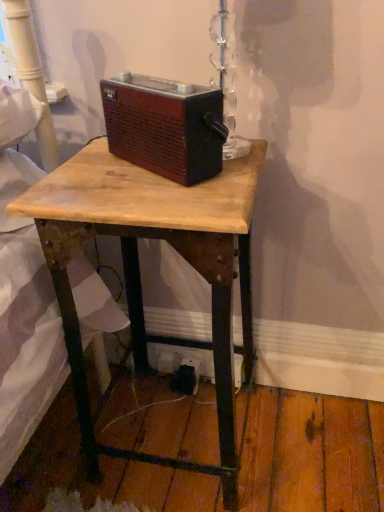
Question: Visually, is black plastic outlet at lower center positioned to the left or to the right of brown wood radio at center?

Choices:
 (A) left
 (B) right

Answer: (B)

Question: Does point (193, 380) appear closer or farther from the camera than point (170, 130)?

Choices:
 (A) farther
 (B) closer

Answer: (A)

Question: Which object is positioned farthest from the wooden desk at center?

Choices:
 (A) black plastic outlet at lower center
 (B) brown wood radio at center

Answer: (A)

Question: Which is nearer to the wooden desk at center?

Choices:
 (A) brown wood radio at center
 (B) black plastic outlet at lower center

Answer: (A)